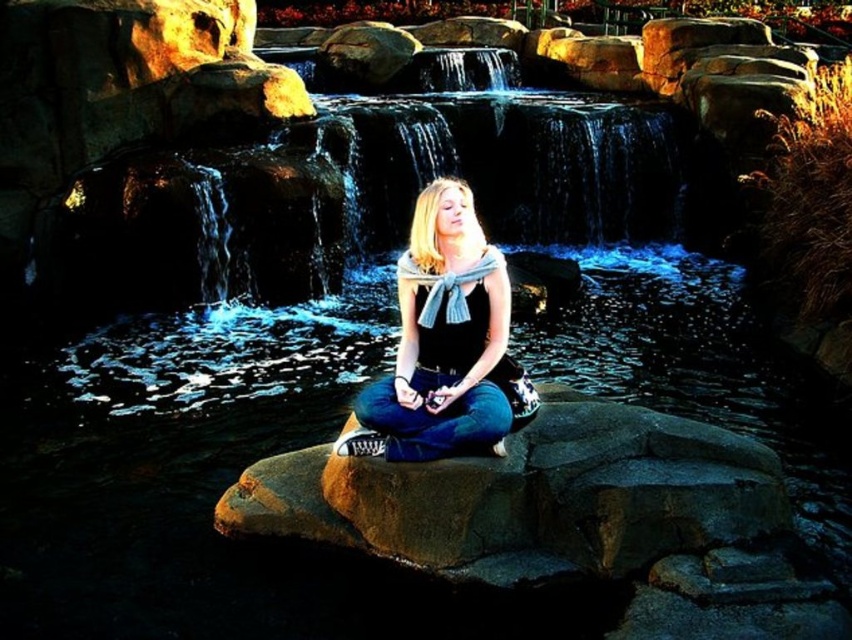
You are a photographer planning to capture the scene with the brown rough rock at center and the matte black tank top at center. If your camera frame can only accommodate objects wider than 30 cm, will both objects fit within the frame?

The brown rough rock at center is less in width than the matte black tank top at center. However, without specific measurements, it is impossible to determine if both objects meet the 30 cm requirement. Additional information about their actual widths is needed to confirm.

You are a photographer trying to capture the person sitting on the rock. Based on the scene, which object is closer to the camera? The brown rough rock at center or the matte black tank top at center?

The brown rough rock at center is positioned under the matte black tank top at center, so the matte black tank top at center is closer to the camera.

You are standing at the base of the waterfall and see the person sitting on a large rock. Can you determine if the point labeled as point [528,497] is located on the same rock where the person is sitting?

The point labeled as point [528,497] is located on the brown rough rock at center. Since the person is sitting on a large rock in the foreground, it is likely that the brown rough rock at center is the same rock where the person is sitting. Therefore, the point is on the same rock.